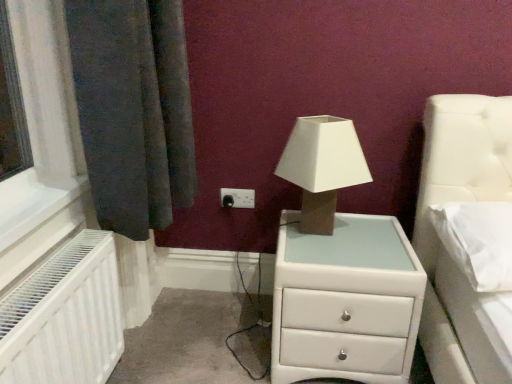
Question: Does white plastic electric outlet at center have a lesser height compared to white soft pillow at right?

Choices:
 (A) no
 (B) yes

Answer: (B)

Question: Is white plastic electric outlet at center at the left side of white soft pillow at right?

Choices:
 (A) yes
 (B) no

Answer: (A)

Question: Is white plastic electric outlet at center closer to the viewer compared to white soft pillow at right?

Choices:
 (A) yes
 (B) no

Answer: (B)

Question: From the image's perspective, is white plastic electric outlet at center beneath white soft pillow at right?

Choices:
 (A) yes
 (B) no

Answer: (B)

Question: Are white plastic electric outlet at center and white soft pillow at right far apart?

Choices:
 (A) yes
 (B) no

Answer: (B)

Question: From a real-world perspective, does white plastic electric outlet at center sit lower than white soft pillow at right?

Choices:
 (A) yes
 (B) no

Answer: (A)

Question: Is matte beige cardboard at center taller than white plastic electric outlet at center?

Choices:
 (A) yes
 (B) no

Answer: (A)

Question: From the image's perspective, is matte beige cardboard at center below white plastic electric outlet at center?

Choices:
 (A) no
 (B) yes

Answer: (A)

Question: Considering the relative positions of matte beige cardboard at center and white plastic electric outlet at center in the image provided, is matte beige cardboard at center to the left of white plastic electric outlet at center from the viewer's perspective?

Choices:
 (A) yes
 (B) no

Answer: (B)

Question: Is matte beige cardboard at center to the right of white plastic electric outlet at center from the viewer's perspective?

Choices:
 (A) yes
 (B) no

Answer: (A)

Question: Can you confirm if matte beige cardboard at center is shorter than white plastic electric outlet at center?

Choices:
 (A) yes
 (B) no

Answer: (B)

Question: Can you confirm if matte beige cardboard at center is thinner than white plastic electric outlet at center?

Choices:
 (A) no
 (B) yes

Answer: (A)

Question: Can you confirm if white glossy chest of drawers at center is bigger than white soft pillow at right?

Choices:
 (A) yes
 (B) no

Answer: (A)